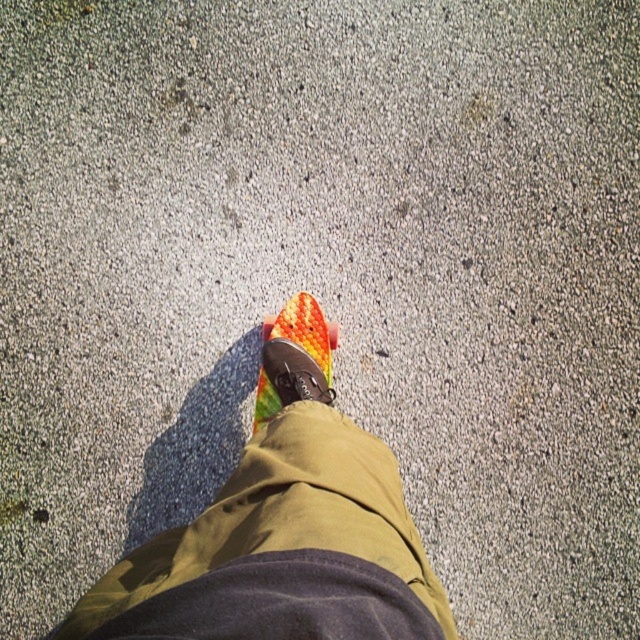
You are a fashion designer observing the image. You need to determine the placement of the multicolored rubber shoe at center and the orange textured toe at center in relation to each other. Which object is positioned lower?

The multicolored rubber shoe at center is located below orange textured toe at center, so the multicolored rubber shoe at center is positioned lower.

You are a delivery robot that needs to step over an obstacle. You see a rubberized orange skateboard at center and a multicolored rubber shoe at center. Which object is taller and can be stepped over more easily?

The rubberized orange skateboard at center is taller than the multicolored rubber shoe at center, so it can be stepped over more easily.

You are a delivery robot that needs to place a package on the rubberized orange skateboard at center. The robot has a 20 cm wide arm. Can the robot place the package on the skateboard without touching the multicolored rubber shoe at center?

The rubberized orange skateboard at center is 22.42 centimeters away from the multicolored rubber shoe at center. Since the robot arm is 20 cm wide, there is enough space between them to place the package without touching the shoe.